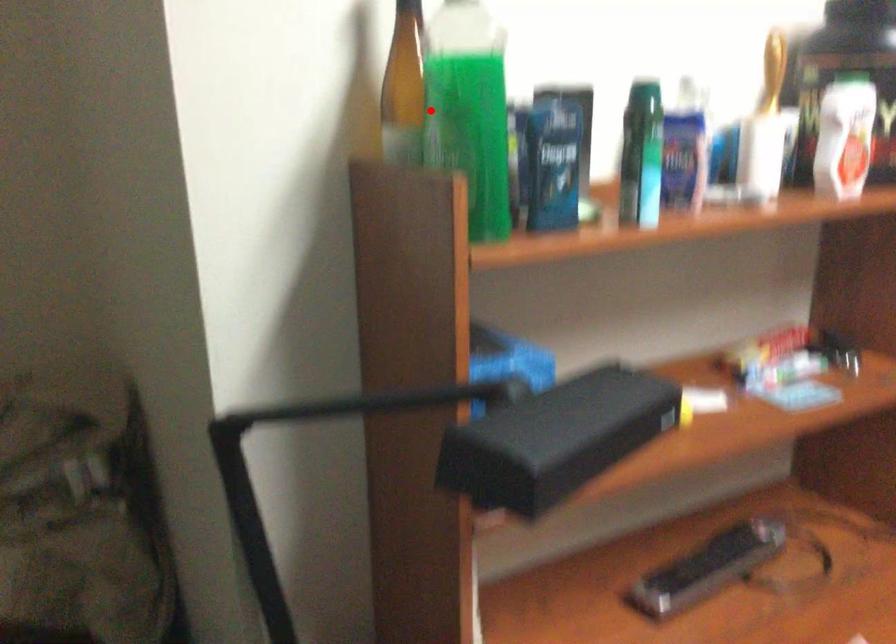
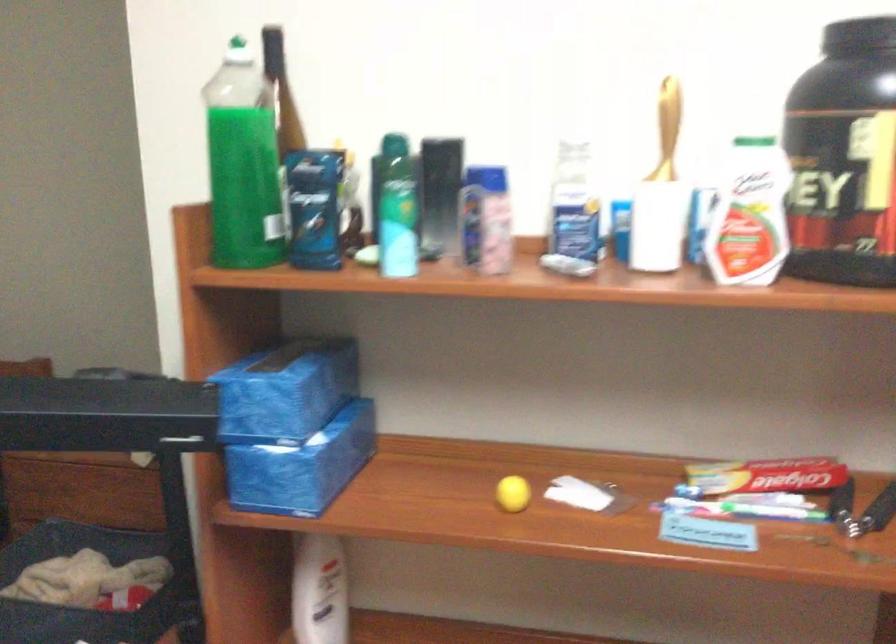
Question: A red point is marked in image1. In image2, is the corresponding 3D point closer to the camera or farther? Reply with the corresponding letter.

Choices:
 (A) The corresponding 3D point is closer.
 (B) The corresponding 3D point is farther.

Answer: (B)